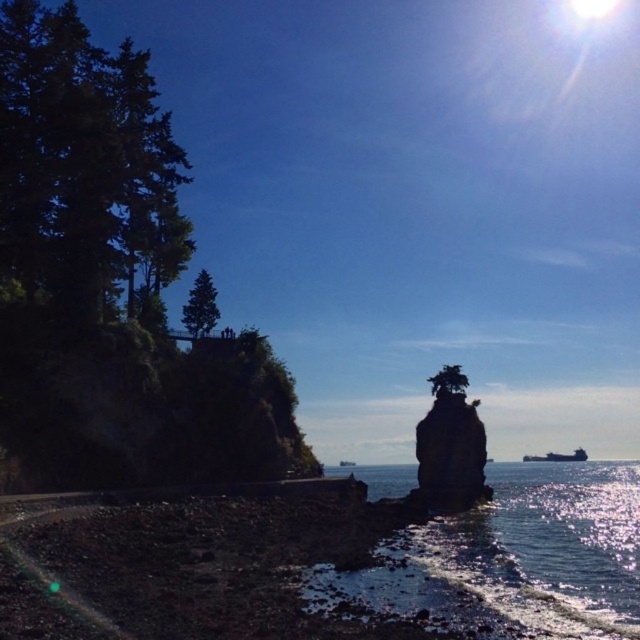
Can you confirm if green leafy tree at center is wider than metallic gray ship at lower right?

In fact, green leafy tree at center might be narrower than metallic gray ship at lower right.

Who is more distant from viewer, [442,371] or [563,456]?

The point [563,456] is behind.

Identify the location of green leafy tree at center. (449, 380).

Which is above, shiny blue water at lower center or smooth gray rock at center?

smooth gray rock at center

Can you confirm if shiny blue water at lower center is smaller than smooth gray rock at center?

No, shiny blue water at lower center is not smaller than smooth gray rock at center.

Between point (582, 536) and point (476, 497), which one is positioned behind?

Point (476, 497)

Find the location of `shiny blue water at lower center`. shiny blue water at lower center is located at coordinates (513, 557).

Which of these two, smooth gray rock at center or green leafy tree at center, stands taller?

Standing taller between the two is smooth gray rock at center.

Does point (428, 472) come closer to viewer compared to point (464, 378)?

Yes, point (428, 472) is in front of point (464, 378).

Locate an element on the screen. This screenshot has width=640, height=640. smooth gray rock at center is located at coordinates (451, 444).